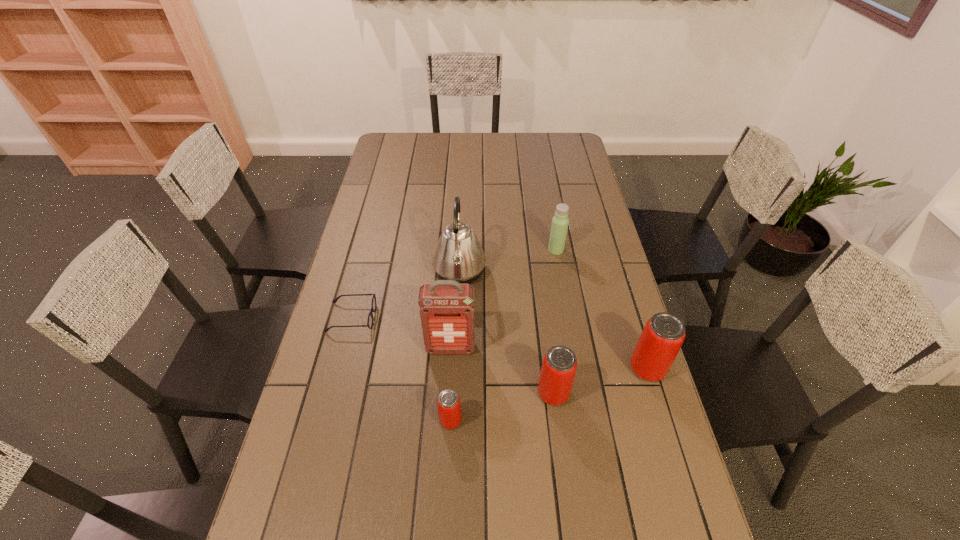
The width and height of the screenshot is (960, 540). In order to click on the shortest beer can in this screenshot , I will do `click(448, 402)`.

Locate an element on the screen. The image size is (960, 540). the leftmost beer can is located at coordinates (448, 402).

Locate an element on the screen. This screenshot has width=960, height=540. the second beer can from right to left is located at coordinates (558, 370).

In order to click on the fifth object from left to right in this screenshot , I will do `click(558, 370)`.

Locate an element on the screen. The image size is (960, 540). the rightmost object is located at coordinates (662, 337).

Where is `the sixth object from left to right`? The height and width of the screenshot is (540, 960). the sixth object from left to right is located at coordinates (560, 221).

The height and width of the screenshot is (540, 960). Identify the location of kettle. (459, 256).

I want to click on the shortest object, so [x=373, y=305].

Where is `the leftmost object`? The width and height of the screenshot is (960, 540). the leftmost object is located at coordinates (373, 305).

Locate an element on the screen. the first-aid kit is located at coordinates (446, 309).